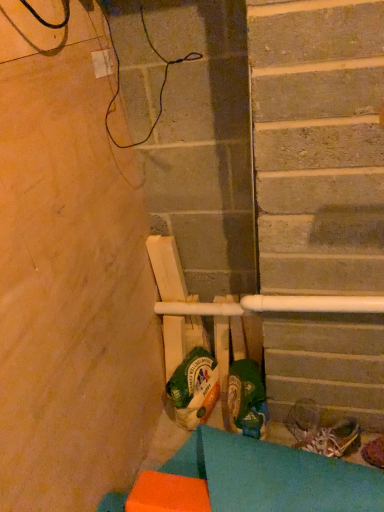
Question: From the image's perspective, is orange foam block at lower left on shiny metallic shoe at lower right, the third footwear in the left-to-right sequence?

Choices:
 (A) yes
 (B) no

Answer: (B)

Question: Is orange foam block at lower left oriented towards shiny metallic shoe at lower right, which is counted as the first footwear, starting from the right?

Choices:
 (A) no
 (B) yes

Answer: (A)

Question: Is orange foam block at lower left positioned behind shiny metallic shoe at lower right, which is counted as the first footwear, starting from the right?

Choices:
 (A) yes
 (B) no

Answer: (B)

Question: Considering the relative positions of orange foam block at lower left and shiny metallic shoe at lower right, the third footwear in the left-to-right sequence, in the image provided, is orange foam block at lower left to the left of shiny metallic shoe at lower right, the third footwear in the left-to-right sequence, from the viewer's perspective?

Choices:
 (A) yes
 (B) no

Answer: (A)

Question: Does orange foam block at lower left have a lesser width compared to shiny metallic shoe at lower right, the third footwear in the left-to-right sequence?

Choices:
 (A) no
 (B) yes

Answer: (A)

Question: Considering the relative sizes of orange foam block at lower left and shiny metallic shoe at lower right, the third footwear in the left-to-right sequence, in the image provided, is orange foam block at lower left smaller than shiny metallic shoe at lower right, the third footwear in the left-to-right sequence,?

Choices:
 (A) yes
 (B) no

Answer: (B)

Question: Considering the relative sizes of shiny metallic shoe at lower right, which is counted as the first footwear, starting from the right, and green fabric shoe at center, the 1th footwear viewed from the left, in the image provided, is shiny metallic shoe at lower right, which is counted as the first footwear, starting from the right, thinner than green fabric shoe at center, the 1th footwear viewed from the left,?

Choices:
 (A) yes
 (B) no

Answer: (A)

Question: From a real-world perspective, is shiny metallic shoe at lower right, which is counted as the first footwear, starting from the right, located beneath green fabric shoe at center, the 3th footwear when ordered from right to left?

Choices:
 (A) no
 (B) yes

Answer: (B)

Question: Is shiny metallic shoe at lower right, the third footwear in the left-to-right sequence, positioned before green fabric shoe at center, the 3th footwear when ordered from right to left?

Choices:
 (A) no
 (B) yes

Answer: (B)

Question: Is shiny metallic shoe at lower right, the third footwear in the left-to-right sequence, bigger than green fabric shoe at center, the 3th footwear when ordered from right to left?

Choices:
 (A) yes
 (B) no

Answer: (B)

Question: Can you confirm if shiny metallic shoe at lower right, the third footwear in the left-to-right sequence, is wider than green fabric shoe at center, the 1th footwear viewed from the left?

Choices:
 (A) yes
 (B) no

Answer: (B)

Question: Is shiny metallic shoe at lower right, the third footwear in the left-to-right sequence, beside green fabric shoe at center, the 3th footwear when ordered from right to left?

Choices:
 (A) no
 (B) yes

Answer: (A)

Question: Is shiny metallic shoes at lower right, the 2th footwear positioned from the left, closer to camera compared to green fabric shoe at center, the 1th footwear viewed from the left?

Choices:
 (A) no
 (B) yes

Answer: (A)